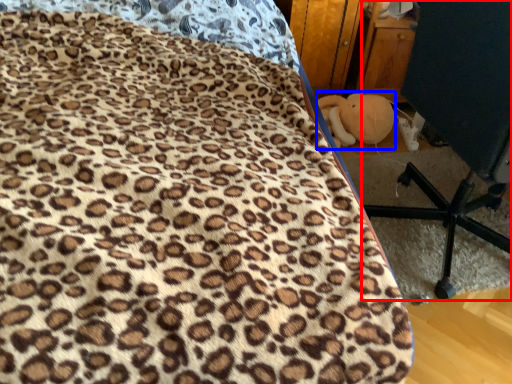
Question: Which object is closer to the camera taking this photo, furniture (highlighted by a red box) or toy (highlighted by a blue box)?

Choices:
 (A) furniture
 (B) toy

Answer: (A)